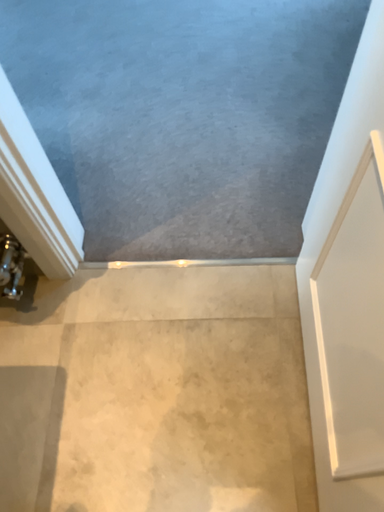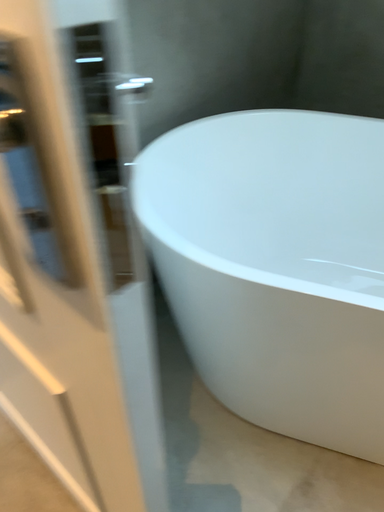
Question: How did the camera likely rotate when shooting the video?

Choices:
 (A) rotated right
 (B) rotated left

Answer: (A)